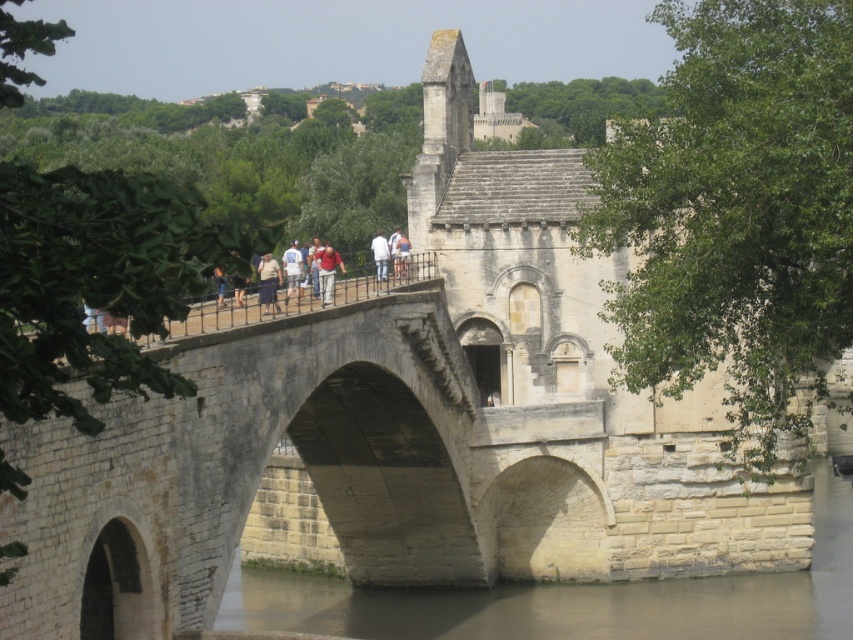
Question: Does red shirt at center have a smaller size compared to light brown leather jacket at center?

Choices:
 (A) no
 (B) yes

Answer: (A)

Question: Does stone arch bridge at center have a greater width compared to light brown leather jacket at center?

Choices:
 (A) yes
 (B) no

Answer: (A)

Question: Which of the following is the farthest from the observer?

Choices:
 (A) red shirt at center
 (B) white cotton shirt at center

Answer: (A)

Question: Considering the real-world distances, which object is farthest from the red shirt at center?

Choices:
 (A) stone arch bridge at center
 (B) light blue jeans at center
 (C) white cotton shirt at center

Answer: (A)

Question: Can you confirm if stone arch bridge at center is positioned above red shirt at center?

Choices:
 (A) no
 (B) yes

Answer: (A)

Question: Which point is closer to the camera?

Choices:
 (A) stone arch bridge at center
 (B) light blue jeans at center
 (C) light brown leather jacket at center

Answer: (C)